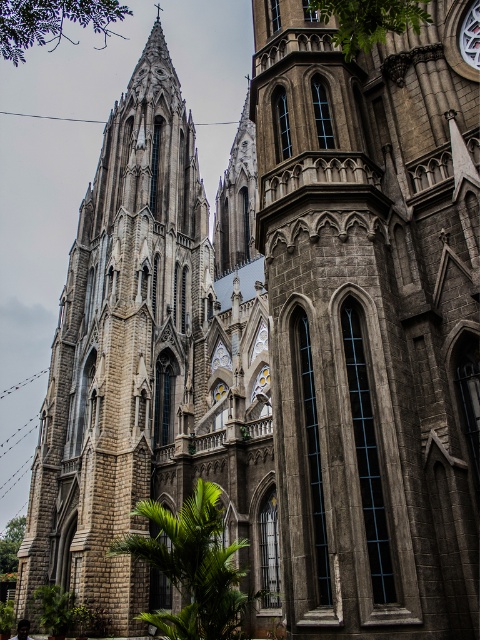
You are an architect analyzing the symmetry of the Gothic church. You observe the gray stone tower at center and the stone tower at left. Which tower is shorter?

The gray stone tower at center is shorter than the stone tower at left.

You are an architect examining the Gothic church. You notice two towers on the facade. Which tower has a smaller width between the gray stone tower at center and the stone tower at left?

The gray stone tower at center is thinner than the stone tower at left, so the gray stone tower at center has a smaller width.

You are standing in front of the grand Gothic church and notice two stone towers. The gray stone tower at center and the stone tower at left. Which tower is positioned lower in the image?

The gray stone tower at center is positioned lower than the stone tower at left.